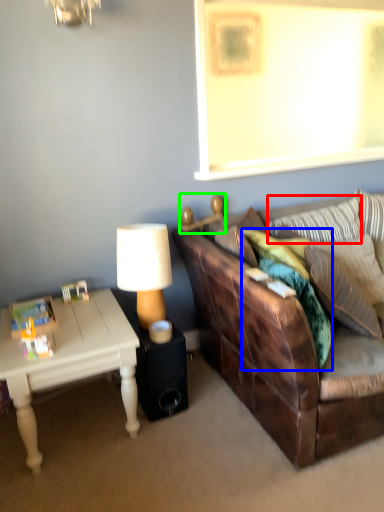
Question: Estimate the real-world distances between objects in this image. Which object is closer to pillow (highlighted by a red box), pillow (highlighted by a blue box) or lamp (highlighted by a green box)?

Choices:
 (A) pillow
 (B) lamp

Answer: (A)